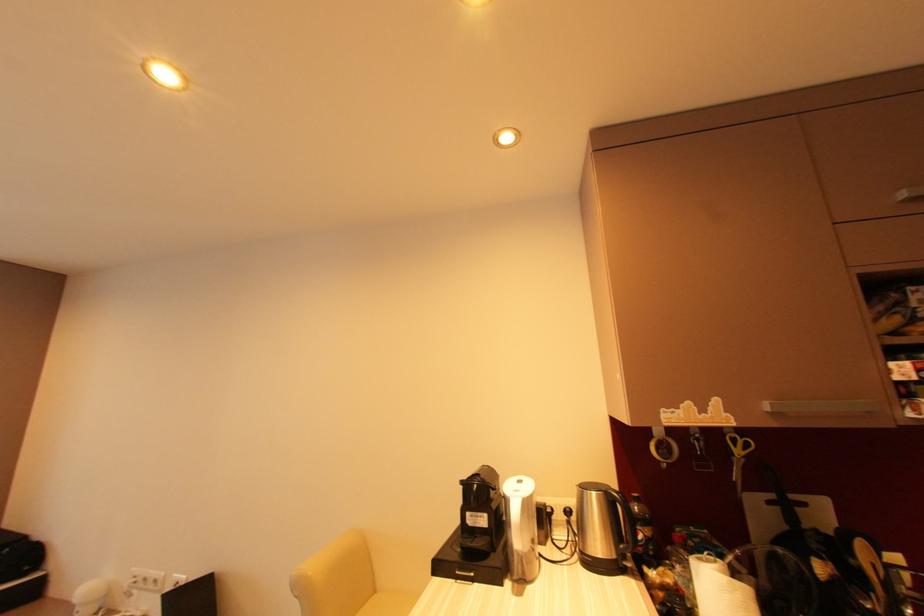
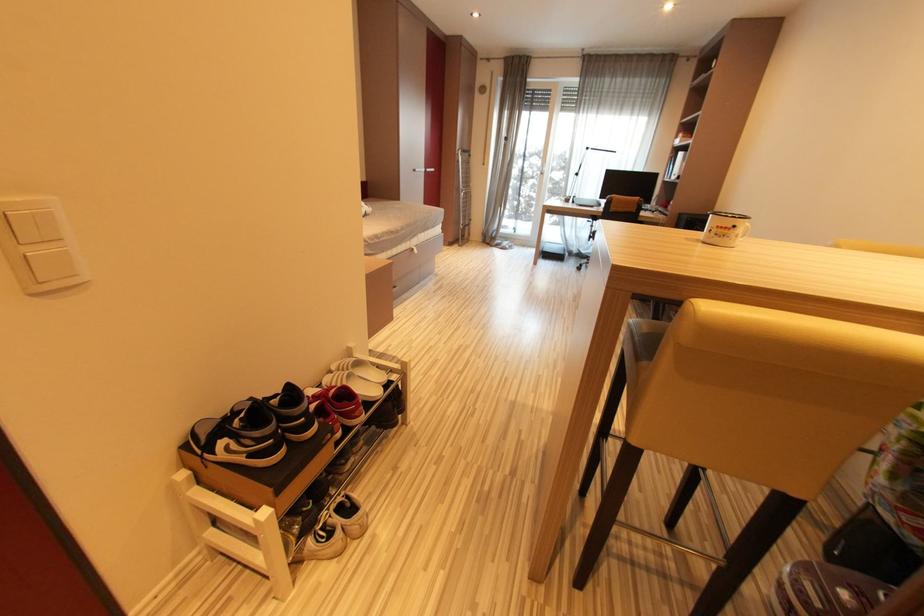
Consider the image. Based on the continuous images, in which direction is the camera rotating?

The rotation direction of the camera is left-down.